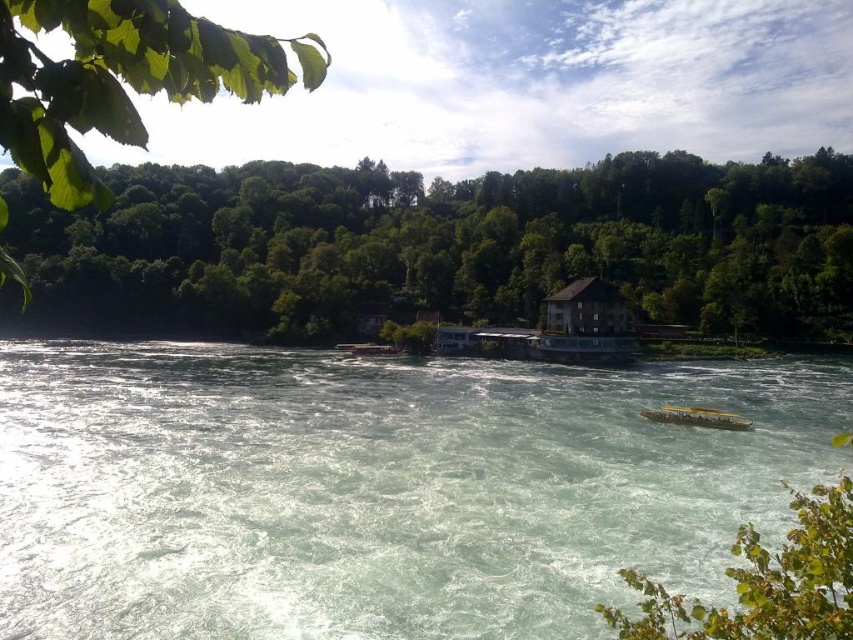
Question: Does white frothy water at center have a greater width compared to green leafy trees at upper center?

Choices:
 (A) no
 (B) yes

Answer: (A)

Question: Can you confirm if white frothy water at center is positioned to the left of green leafy trees at upper center?

Choices:
 (A) no
 (B) yes

Answer: (A)

Question: Which object appears farthest from the camera in this image?

Choices:
 (A) green leafy trees at upper center
 (B) white frothy water at center

Answer: (A)

Question: Does white frothy water at center have a lesser width compared to green leafy trees at upper center?

Choices:
 (A) yes
 (B) no

Answer: (A)